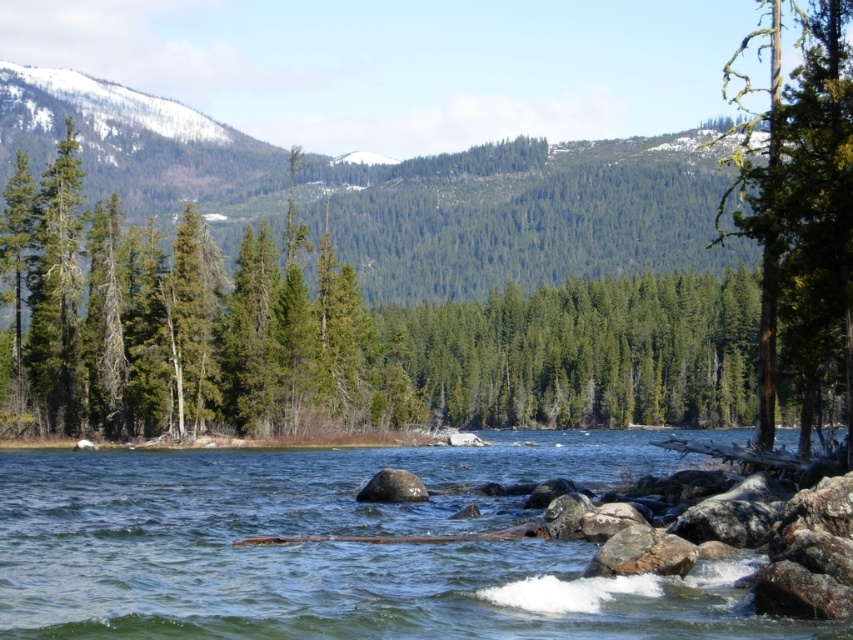
Which is in front, point (561, 296) or point (161, 536)?

Positioned in front is point (161, 536).

Is point (415, 349) farther from viewer compared to point (90, 545)?

Yes, point (415, 349) is behind point (90, 545).

Who is more distant from viewer, (541, 362) or (448, 461)?

Positioned behind is point (541, 362).

Where is `green matte tree at center`? green matte tree at center is located at coordinates (341, 337).

Does point (479, 336) come farther from viewer compared to point (763, 369)?

Yes.

Can you confirm if green matte tree at center is shorter than green rough bark tree at right?

Indeed, green matte tree at center has a lesser height compared to green rough bark tree at right.

The width and height of the screenshot is (853, 640). What are the coordinates of `green matte tree at center` in the screenshot? It's located at (341, 337).

Is point (352, 522) positioned before point (798, 70)?

Yes.

Locate an element on the screen. This screenshot has width=853, height=640. clear water at center is located at coordinates (337, 547).